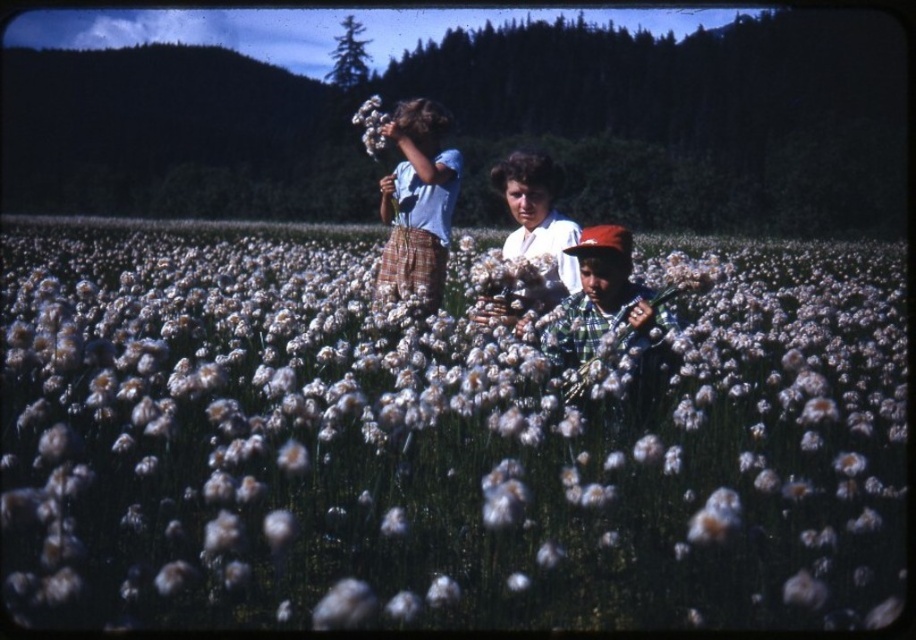
Question: Considering the relative positions of white cotton at center and white fluffy flower at center in the image provided, where is white cotton at center located with respect to white fluffy flower at center?

Choices:
 (A) right
 (B) left

Answer: (A)

Question: Is white fluffy flowers at center further to camera compared to plaid flannel shirt at center?

Choices:
 (A) yes
 (B) no

Answer: (B)

Question: Among these points, which one is farthest from the camera?

Choices:
 (A) (429, 132)
 (B) (529, 253)

Answer: (A)

Question: Which object is farther from the camera taking this photo?

Choices:
 (A) white fluffy flowers at center
 (B) white cotton at center
 (C) white fluffy flower at center
 (D) plaid flannel shirt at center

Answer: (C)

Question: Does white fluffy flowers at center have a lesser width compared to white cotton at center?

Choices:
 (A) no
 (B) yes

Answer: (A)

Question: Which of the following is the closest to the observer?

Choices:
 (A) tap(387, 120)
 (B) tap(565, 337)
 (C) tap(156, 323)
 (D) tap(529, 237)

Answer: (B)